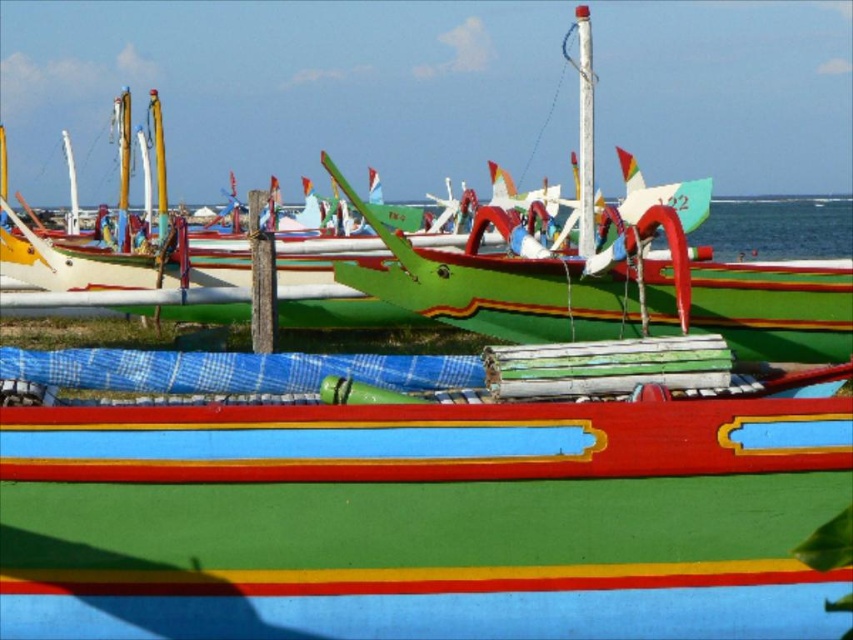
Question: Can you confirm if green painted wood boat at center is positioned above smooth plastic line at lower center?

Choices:
 (A) yes
 (B) no

Answer: (A)

Question: Can you confirm if green painted wood boat at center is smaller than smooth plastic line at lower center?

Choices:
 (A) no
 (B) yes

Answer: (A)

Question: Is green painted wood boat at center further to the viewer compared to smooth plastic line at lower center?

Choices:
 (A) no
 (B) yes

Answer: (B)

Question: Which of the following is the closest to the observer?

Choices:
 (A) green painted wood boat at center
 (B) smooth plastic line at lower center

Answer: (B)